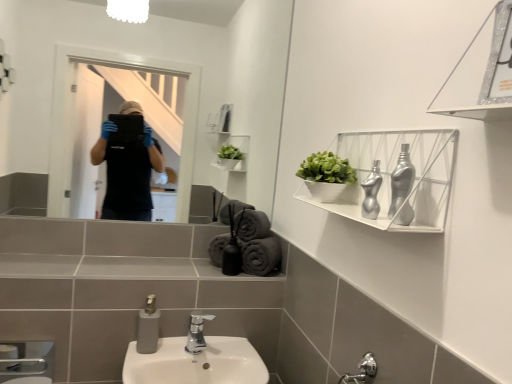
Question: Should I look upward or downward to see white matte shelf at upper right, which is counted as the 2th shelf, starting from the front?

Choices:
 (A) up
 (B) down

Answer: (A)

Question: Does gray cotton towels at lower center, the 4th bath towel viewed from the left, come in front of white matte shelf at upper right, the first shelf viewed from the back?

Choices:
 (A) yes
 (B) no

Answer: (B)

Question: Does gray cotton towels at lower center, marked as the 1th bath towel in a right-to-left arrangement, appear on the right side of white matte shelf at upper right, the first shelf viewed from the back?

Choices:
 (A) no
 (B) yes

Answer: (A)

Question: Does gray cotton towels at lower center, marked as the 1th bath towel in a right-to-left arrangement, have a greater width compared to white matte shelf at upper right, which is counted as the 2th shelf, starting from the front?

Choices:
 (A) yes
 (B) no

Answer: (A)

Question: Is gray cotton towels at lower center, the 4th bath towel viewed from the left, further to camera compared to white matte shelf at upper right, the first shelf viewed from the back?

Choices:
 (A) no
 (B) yes

Answer: (B)

Question: Is gray cotton towels at lower center, the 4th bath towel viewed from the left, located outside white matte shelf at upper right, the first shelf viewed from the back?

Choices:
 (A) yes
 (B) no

Answer: (A)

Question: Can you confirm if gray cotton towels at lower center, the 4th bath towel viewed from the left, is bigger than white matte shelf at upper right, the first shelf viewed from the back?

Choices:
 (A) yes
 (B) no

Answer: (B)

Question: Is gray cotton bath towel at center, which ranks as the 4th bath towel in right-to-left order, taller than gray cotton bath towel at center, the third bath towel viewed from the left?

Choices:
 (A) yes
 (B) no

Answer: (A)

Question: Does gray cotton bath towel at center, which ranks as the 4th bath towel in right-to-left order, lie in front of gray cotton bath towel at center, the third bath towel viewed from the left?

Choices:
 (A) no
 (B) yes

Answer: (A)

Question: Can you confirm if gray cotton bath towel at center, which ranks as the 4th bath towel in right-to-left order, is positioned to the right of gray cotton bath towel at center, which is the 2th bath towel in right-to-left order?

Choices:
 (A) no
 (B) yes

Answer: (A)

Question: Is gray cotton bath towel at center, which ranks as the 4th bath towel in right-to-left order, at the left side of gray cotton bath towel at center, which is the 2th bath towel in right-to-left order?

Choices:
 (A) yes
 (B) no

Answer: (A)

Question: Does gray cotton bath towel at center, which ranks as the 4th bath towel in right-to-left order, touch gray cotton bath towel at center, the third bath towel viewed from the left?

Choices:
 (A) no
 (B) yes

Answer: (B)

Question: Is gray cotton bath towel at center, acting as the first bath towel starting from the left, wider than gray cotton bath towel at center, which is the 2th bath towel in right-to-left order?

Choices:
 (A) no
 (B) yes

Answer: (A)

Question: Does metallic silver shelf at upper right, marked as the 1th shelf in a front-to-back arrangement, have a lesser height compared to gray matte soap dispenser at lower center?

Choices:
 (A) no
 (B) yes

Answer: (A)